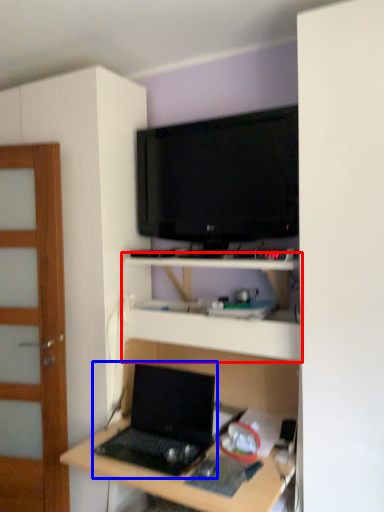
Question: Which of the following is the closest to the observer, shelf (highlighted by a red box) or laptop (highlighted by a blue box)?

Choices:
 (A) shelf
 (B) laptop

Answer: (B)